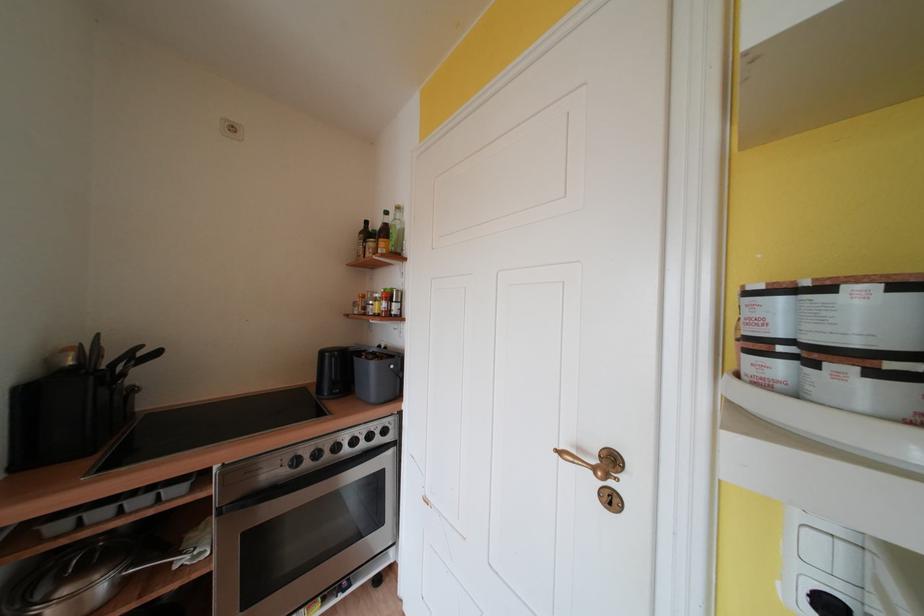
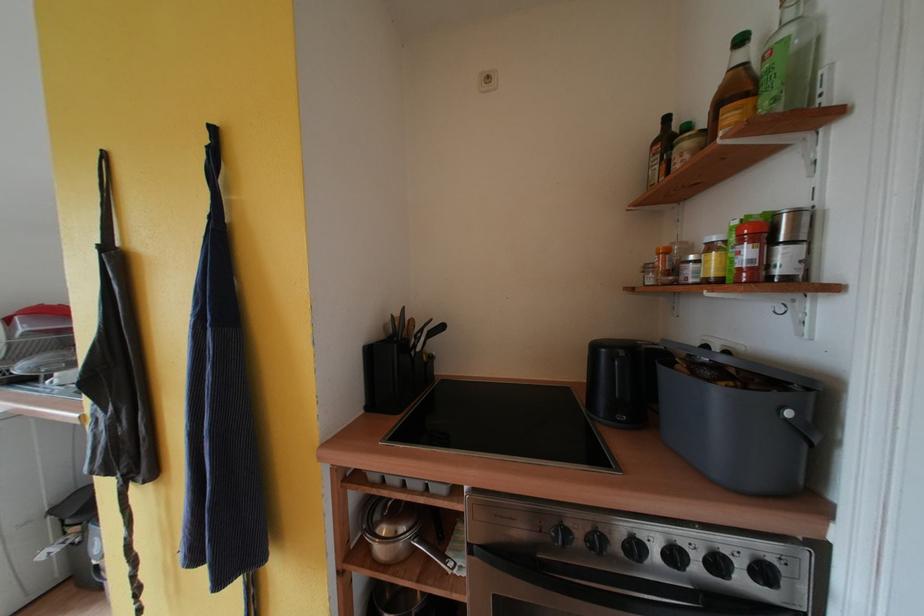
In the second image, find the point that corresponds to point (391, 308) in the first image.

(755, 256)